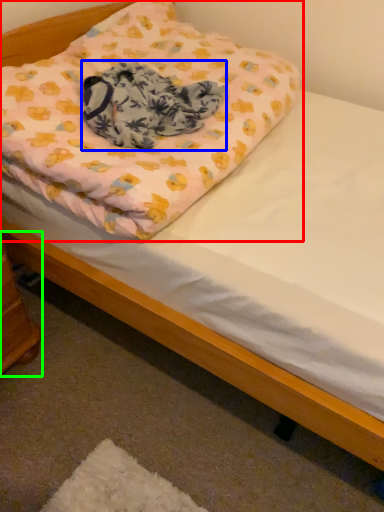
Question: Which object is positioned farthest from pillow (highlighted by a red box)? Select from blanket (highlighted by a blue box) and changing table (highlighted by a green box).

Choices:
 (A) blanket
 (B) changing table

Answer: (B)